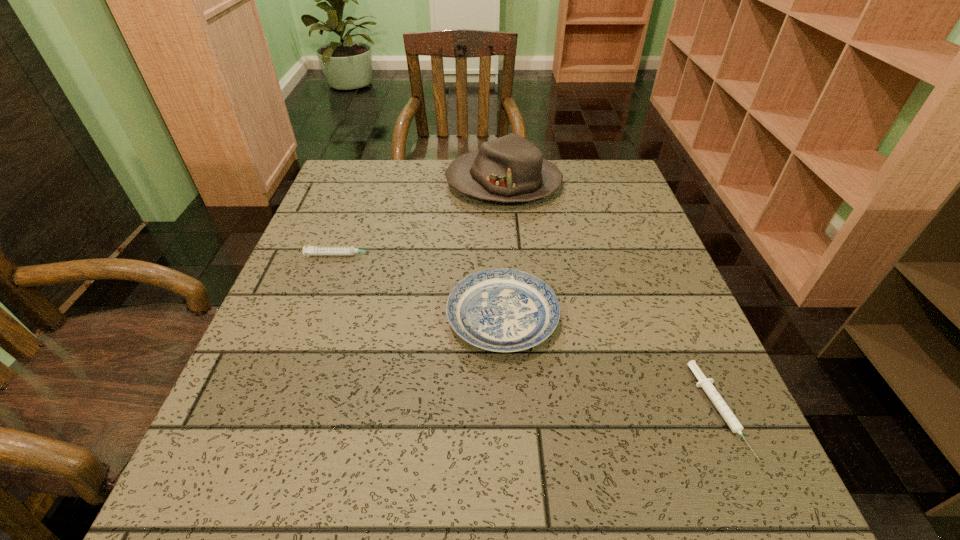
This screenshot has width=960, height=540. What are the coordinates of `free location that satisfies the following two spatial constraints: 1. on the front side of the shorter syringe; 2. on the right side of the second nearest object` in the screenshot? It's located at (507, 410).

Identify the location of free space that satisfies the following two spatial constraints: 1. on the decorative side of the hat; 2. on the front side of the third shortest object. (514, 317).

Find the location of `free point that satisfies the following two spatial constraints: 1. at the needle end of the shorter syringe; 2. on the left side of the farther syringe`. free point that satisfies the following two spatial constraints: 1. at the needle end of the shorter syringe; 2. on the left side of the farther syringe is located at coordinates (288, 410).

The height and width of the screenshot is (540, 960). I want to click on vacant space that satisfies the following two spatial constraints: 1. at the needle end of the third nearest object; 2. on the right side of the third farthest object, so click(321, 317).

I want to click on free location that satisfies the following two spatial constraints: 1. at the needle end of the plate; 2. on the left side of the left syringe, so (x=321, y=317).